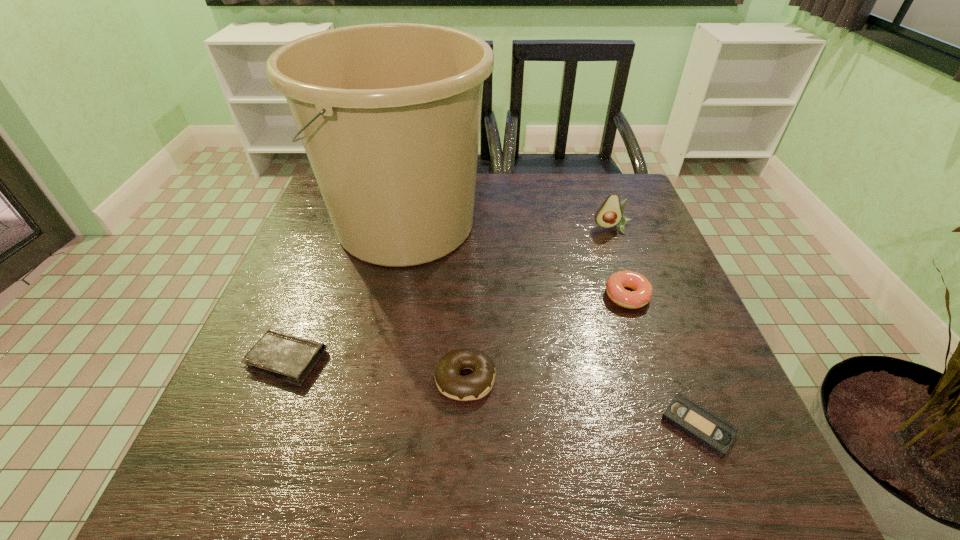
Where is `blank area located 0.190m on the front of the diary`? This screenshot has width=960, height=540. blank area located 0.190m on the front of the diary is located at coordinates (235, 492).

The image size is (960, 540). Identify the location of vacant space situated on the back of the shortest object. (673, 360).

This screenshot has width=960, height=540. Identify the location of object located in the far edge section of the desktop. (389, 114).

The height and width of the screenshot is (540, 960). I want to click on object at the near edge, so (x=708, y=429).

Find the location of a particular element. The width and height of the screenshot is (960, 540). bucket that is at the left edge is located at coordinates (389, 114).

Where is `diary that is at the left edge`? diary that is at the left edge is located at coordinates (290, 358).

Find the location of a particular element. The height and width of the screenshot is (540, 960). avocado located at the right edge is located at coordinates (609, 214).

The height and width of the screenshot is (540, 960). What are the coordinates of `doughnut that is positioned at the right edge` in the screenshot? It's located at pos(642,293).

At what (x,y) coordinates should I click in order to perform the action: click on videotape located in the right edge section of the desktop. Please return your answer as a coordinate pair (x, y). This screenshot has width=960, height=540. Looking at the image, I should click on (708, 429).

This screenshot has width=960, height=540. What are the coordinates of `object that is at the far left corner` in the screenshot? It's located at (389, 114).